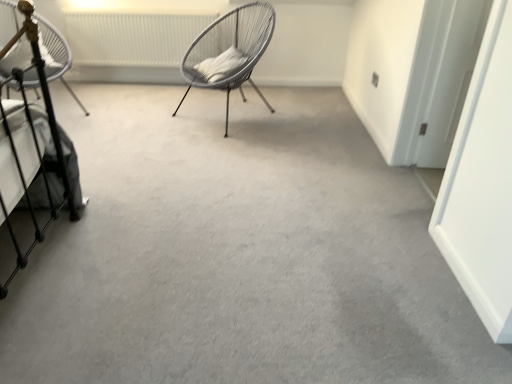
Question: Would you say white woven chair at center, placed as the first chair when sorted from right to left, is to the left or to the right of white woven chair at left, the 1th chair in the left-to-right sequence, in the picture?

Choices:
 (A) left
 (B) right

Answer: (B)

Question: Does point (233, 21) appear closer or farther from the camera than point (65, 84)?

Choices:
 (A) closer
 (B) farther

Answer: (A)

Question: Estimate the real-world distances between objects in this image. Which object is closer to the white woven chair at center, placed as the first chair when sorted from right to left?

Choices:
 (A) white woven chair at left, the 1th chair in the left-to-right sequence
 (B) white textured radiator at upper center

Answer: (B)

Question: Estimate the real-world distances between objects in this image. Which object is closer to the white woven chair at center, acting as the 2th chair starting from the left?

Choices:
 (A) white textured radiator at upper center
 (B) white woven chair at left, which is counted as the second chair, starting from the right

Answer: (A)